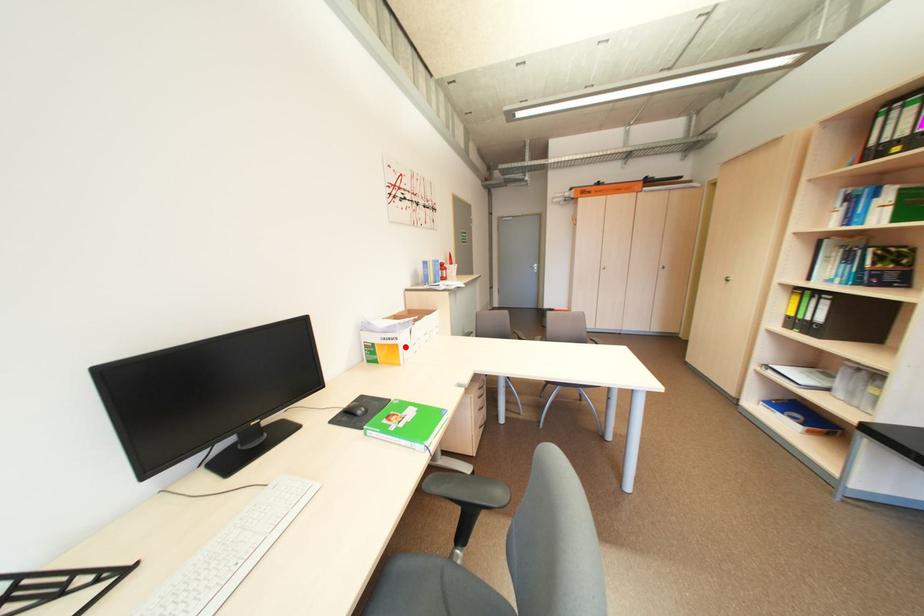
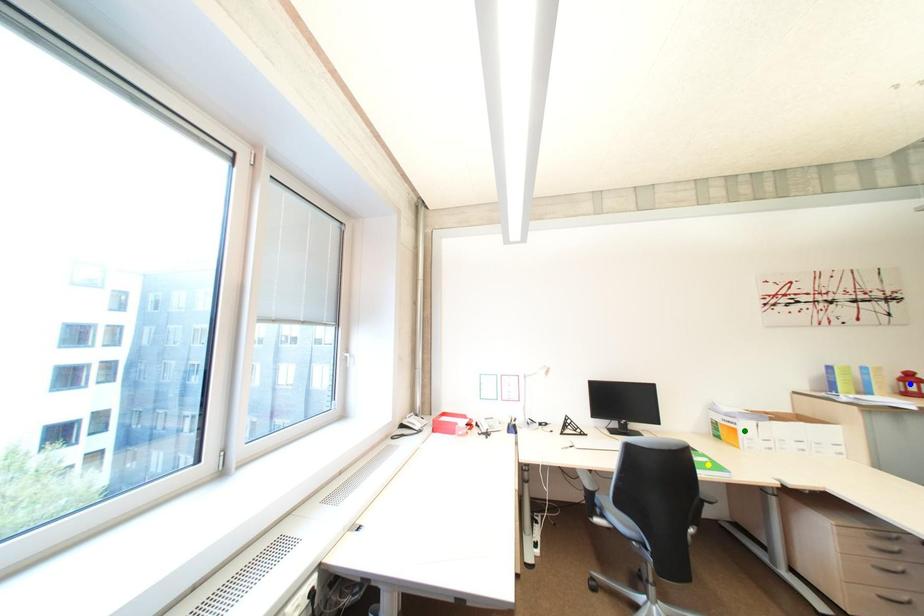
Question: I am providing you with two images of the same scene from different viewpoints. A red point is marked on the first image. You are given multiple points on the second image. Which point in image 2 represents the same 3d spot as the red point in image 1?

Choices:
 (A) yellow point
 (B) blue point
 (C) green point

Answer: (C)